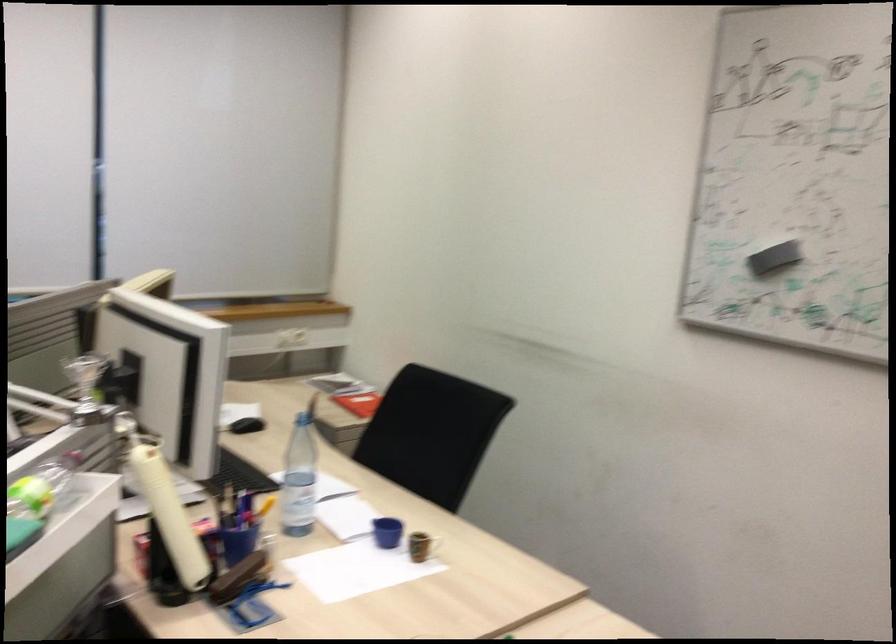
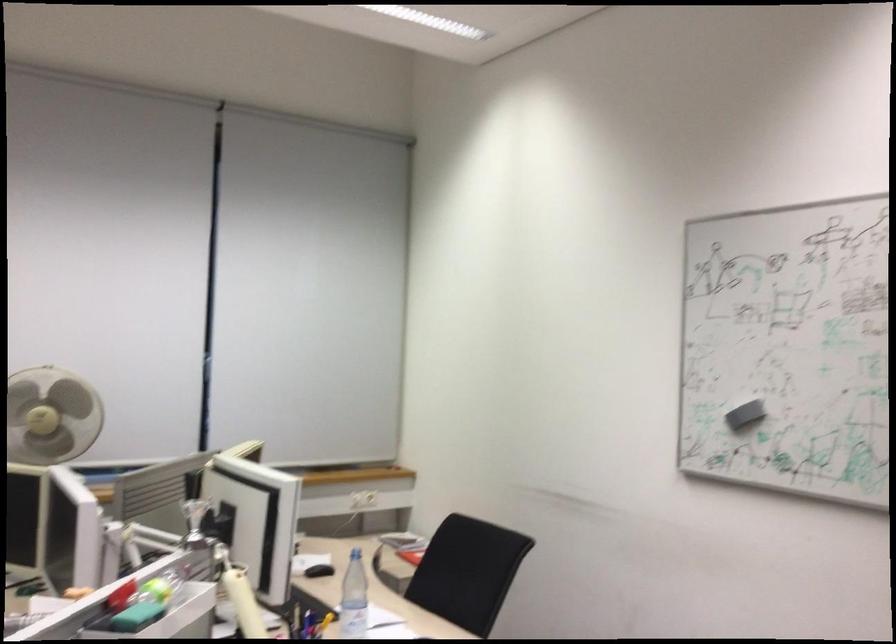
In a continuous first-person perspective shot, in which direction is the camera moving?

The movement direction of the cameraman is right, backward.